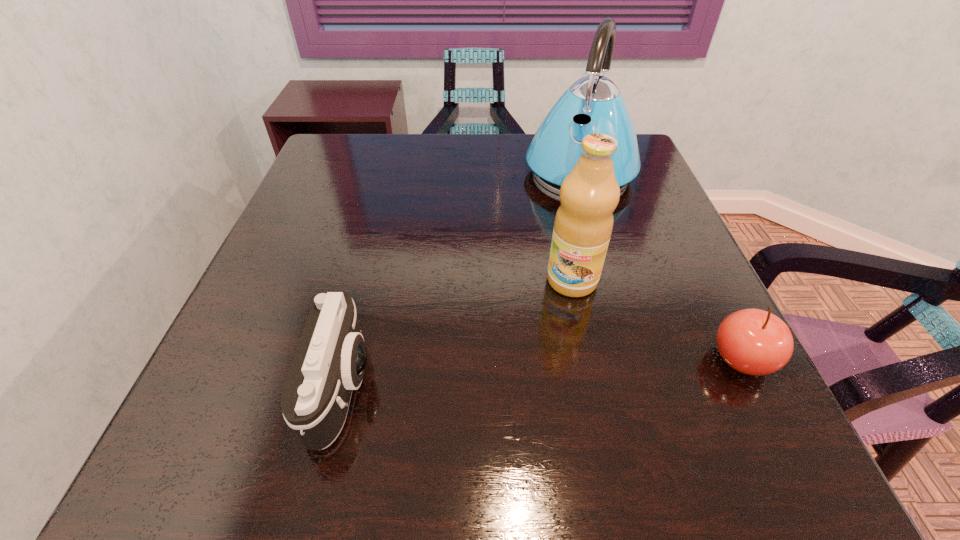
Find the location of a particular element. The image size is (960, 540). camera is located at coordinates (330, 359).

Locate an element on the screen. The width and height of the screenshot is (960, 540). the shortest object is located at coordinates (755, 342).

Find the location of a particular element. Image resolution: width=960 pixels, height=540 pixels. olive oil is located at coordinates (589, 194).

I want to click on the second tallest object, so click(x=589, y=194).

Where is `kettle`? This screenshot has height=540, width=960. kettle is located at coordinates (593, 104).

The width and height of the screenshot is (960, 540). I want to click on the tallest object, so click(593, 104).

Locate an element on the screen. vacant region located 0.210m on the front lens of the camera is located at coordinates [x=499, y=384].

Locate an element on the screen. vacant space located 0.400m on the back of the apple is located at coordinates (664, 206).

Where is `vacant space located 0.150m on the label of the third shortest object`? This screenshot has width=960, height=540. vacant space located 0.150m on the label of the third shortest object is located at coordinates (537, 354).

Image resolution: width=960 pixels, height=540 pixels. Identify the location of vacant space located on the label of the third shortest object. (550, 326).